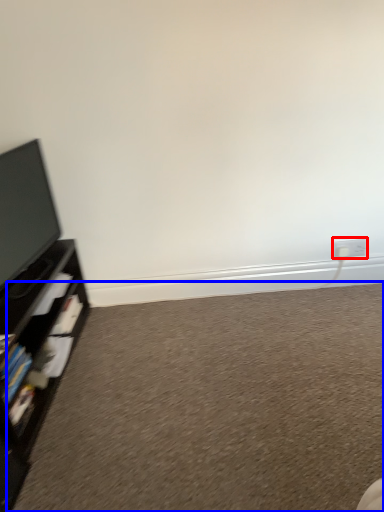
Question: Which object is closer to the camera taking this photo, electric outlet (highlighted by a red box) or plain (highlighted by a blue box)?

Choices:
 (A) electric outlet
 (B) plain

Answer: (B)